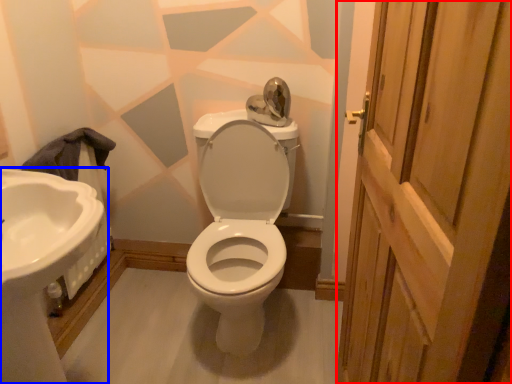
Question: Which object is further to the camera taking this photo, screen door (highlighted by a red box) or sink (highlighted by a blue box)?

Choices:
 (A) screen door
 (B) sink

Answer: (B)